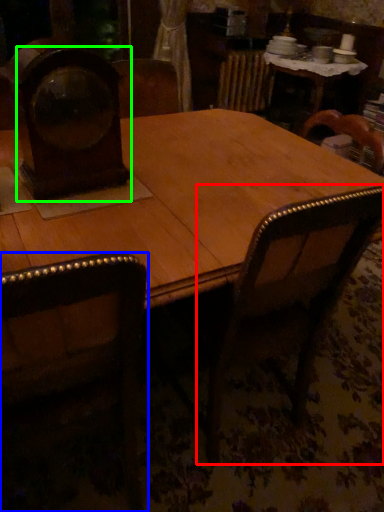
Question: Which object is positioned farthest from armchair (highlighted by a red box)? Select from chair (highlighted by a blue box) and clock (highlighted by a green box).

Choices:
 (A) chair
 (B) clock

Answer: (B)